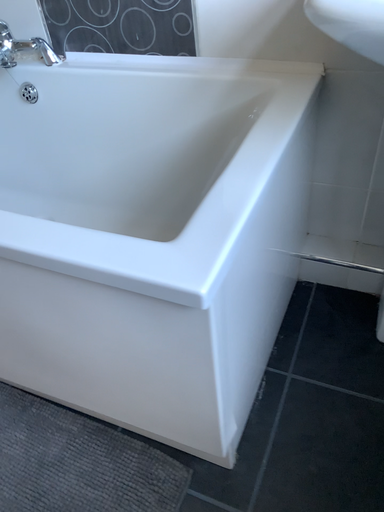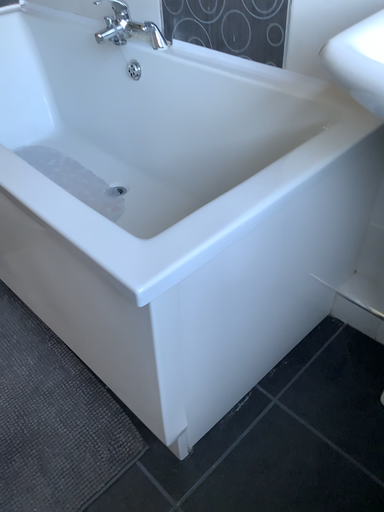
Question: How did the camera likely rotate when shooting the video?

Choices:
 (A) rotated left
 (B) rotated right

Answer: (A)